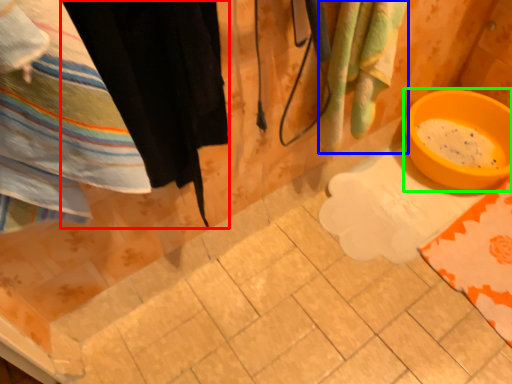
Question: Which object is positioned farthest from clothing (highlighted by a red box)? Select from beach towel (highlighted by a blue box) and basin (highlighted by a green box).

Choices:
 (A) beach towel
 (B) basin

Answer: (B)